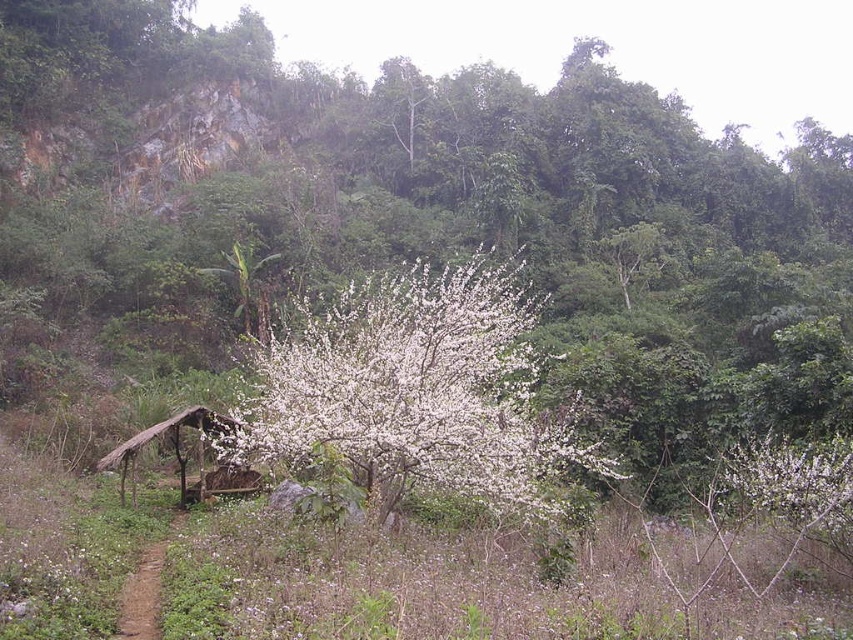
Can you confirm if white fluffy blossoms at center is positioned above brown dirt path at lower left?

Yes, white fluffy blossoms at center is above brown dirt path at lower left.

Describe the element at coordinates (415, 390) in the screenshot. The width and height of the screenshot is (853, 640). I see `white fluffy blossoms at center` at that location.

Describe the element at coordinates (415, 390) in the screenshot. I see `white fluffy blossoms at center` at that location.

Locate an element on the screen. The width and height of the screenshot is (853, 640). white fluffy blossoms at center is located at coordinates (415, 390).

Find the location of a particular element. Image resolution: width=853 pixels, height=640 pixels. white fluffy flowers at center is located at coordinates (790, 481).

Can you confirm if white fluffy flowers at center is taller than brown dirt path at lower left?

Yes, white fluffy flowers at center is taller than brown dirt path at lower left.

What do you see at coordinates (790, 481) in the screenshot? I see `white fluffy flowers at center` at bounding box center [790, 481].

This screenshot has height=640, width=853. I want to click on white fluffy flowers at center, so click(790, 481).

Between white fluffy blossoms at center and white fluffy flowers at center, which one is positioned higher?

white fluffy blossoms at center is above.

Can you confirm if white fluffy blossoms at center is positioned below white fluffy flowers at center?

No.

Between point (397, 355) and point (773, 477), which one is positioned in front?

Point (773, 477)

Image resolution: width=853 pixels, height=640 pixels. Find the location of `white fluffy blossoms at center`. white fluffy blossoms at center is located at coordinates (415, 390).